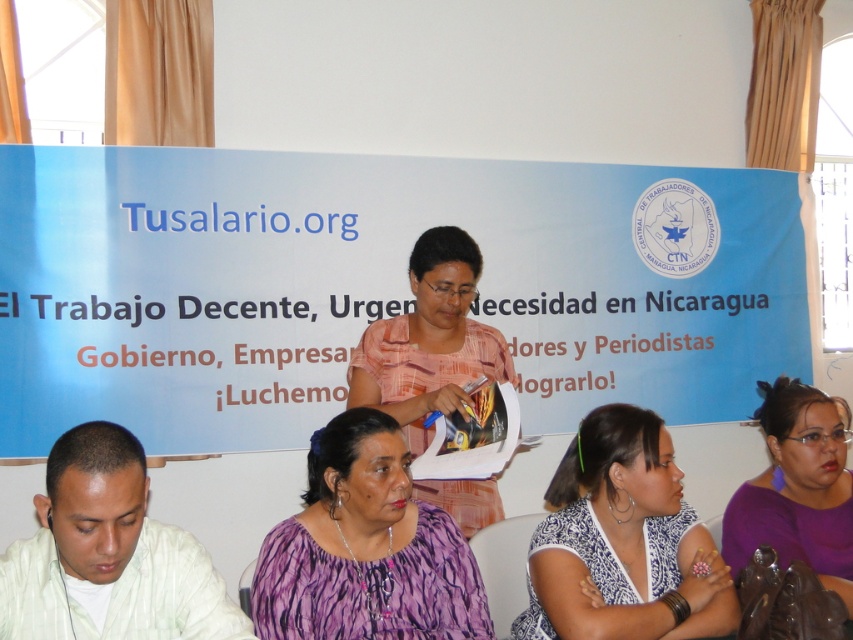
Question: Is purple woven blouse at center below blue printed blouse at center?

Choices:
 (A) no
 (B) yes

Answer: (A)

Question: Which point is farther to the camera?

Choices:
 (A) blue printed blouse at center
 (B) pink fabric at center
 (C) white matte shirt at lower left
 (D) purple woven blouse at center

Answer: (B)

Question: Can you confirm if blue printed blouse at center is thinner than white matte shirt at lower left?

Choices:
 (A) yes
 (B) no

Answer: (B)

Question: Among these objects, which one is nearest to the camera?

Choices:
 (A) blue printed blouse at center
 (B) purple matte shirt at lower right
 (C) purple woven blouse at center

Answer: (C)

Question: Which point appears farthest from the camera in this image?

Choices:
 (A) (654, 602)
 (B) (817, 484)
 (C) (337, 624)
 (D) (166, 531)

Answer: (B)

Question: Can you confirm if white matte shirt at lower left is smaller than pink fabric at center?

Choices:
 (A) no
 (B) yes

Answer: (B)